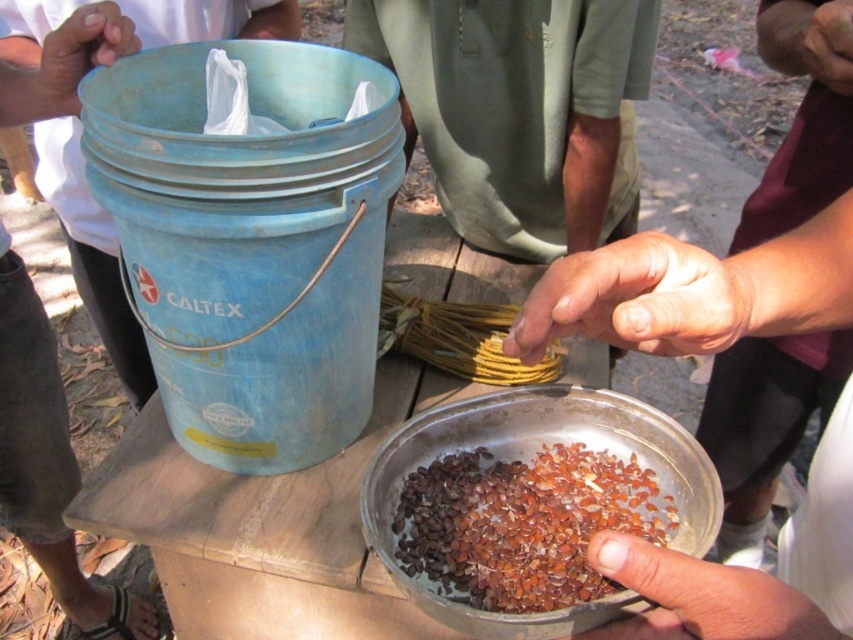
Question: Which point is farther to the camera?

Choices:
 (A) (62, 28)
 (B) (709, 348)
 (C) (509, 515)

Answer: (A)

Question: Can you confirm if brown matte finger at lower center is smaller than smooth skin hand at upper left?

Choices:
 (A) yes
 (B) no

Answer: (A)

Question: Is brown glossy seeds at center thinner than brown matte finger at lower center?

Choices:
 (A) yes
 (B) no

Answer: (B)

Question: Among these objects, which one is farthest from the camera?

Choices:
 (A) brown matte finger at lower center
 (B) dry skin at center

Answer: (B)

Question: Is brown glossy seeds at center thinner than smooth skin hand at upper left?

Choices:
 (A) yes
 (B) no

Answer: (B)

Question: Which object is the closest to the dry skin at center?

Choices:
 (A) brown glossy seeds at center
 (B) brown matte finger at lower center

Answer: (B)